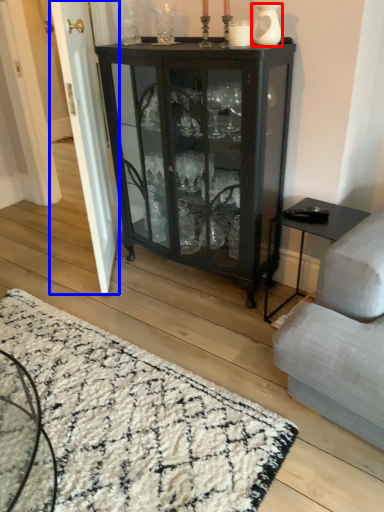
Question: Which of the following is the closest to the observer, glass vase (highlighted by a red box) or screen door (highlighted by a blue box)?

Choices:
 (A) glass vase
 (B) screen door

Answer: (A)